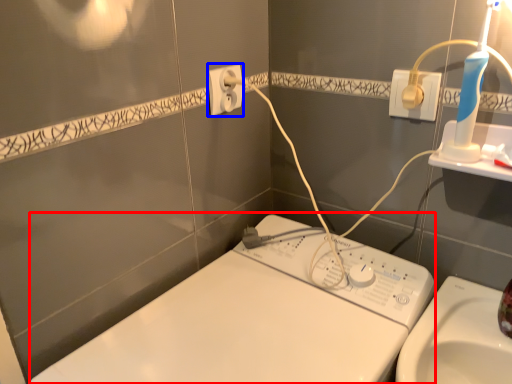
Question: Which point is further to the camera, machine (highlighted by a red box) or power plugs and sockets (highlighted by a blue box)?

Choices:
 (A) machine
 (B) power plugs and sockets

Answer: (B)